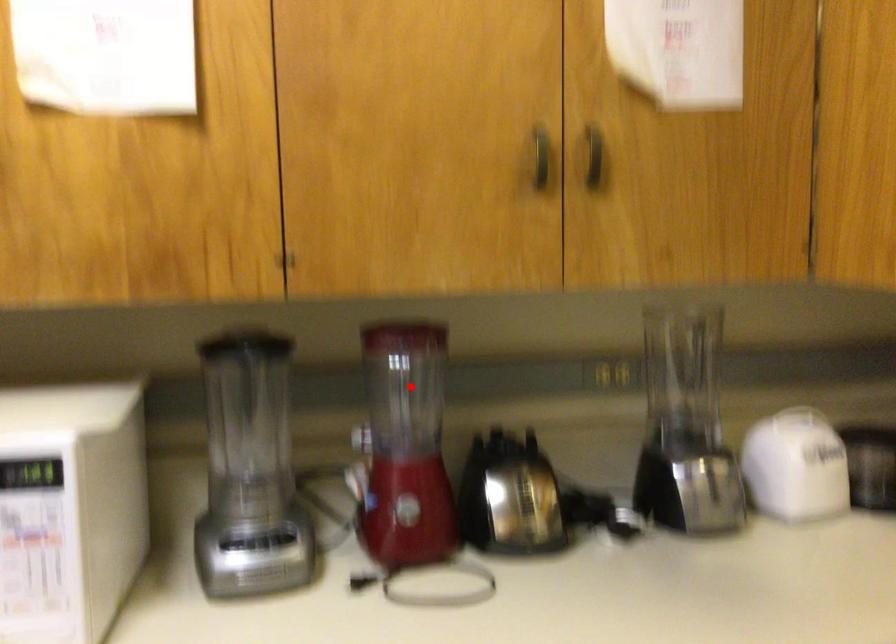
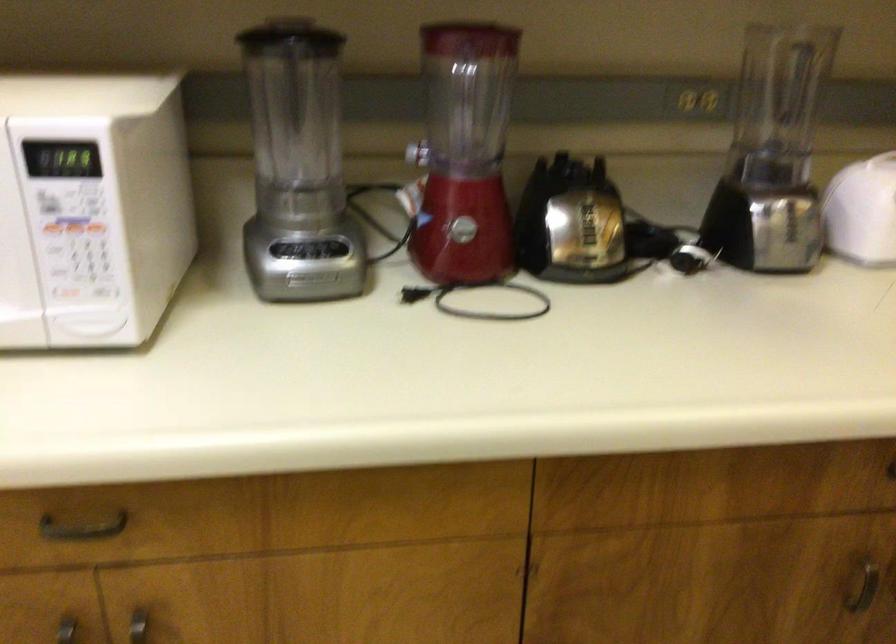
Question: I am providing you with two images of the same scene from different viewpoints. In image1, a red point is highlighted. Considering the same 3D point in image2, which of the following is correct?

Choices:
 (A) It is closer
 (B) It is farther

Answer: (A)